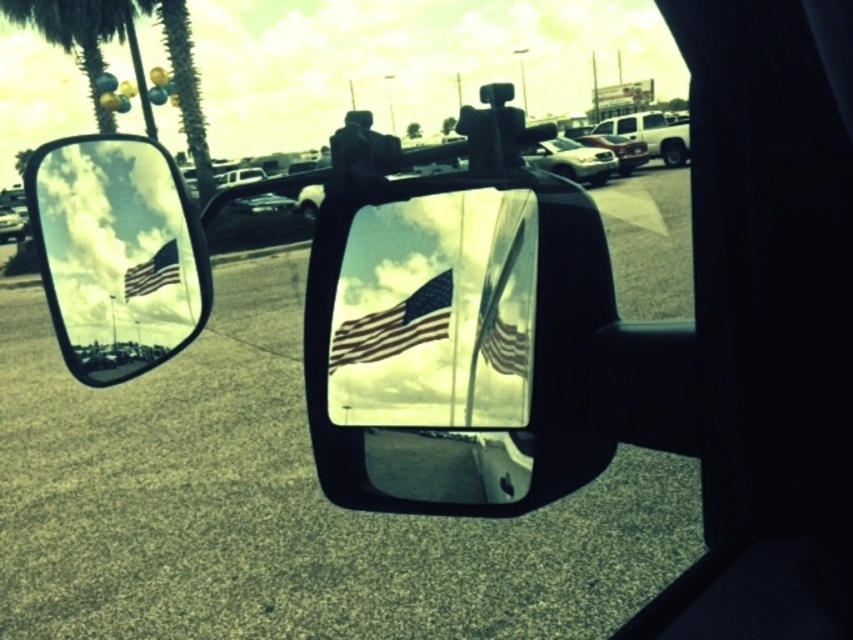
You are a driver checking your side mirrors. You notice a point at coordinates (115, 253). What object is located at that point?

The point at coordinates (115, 253) is where the reflective glass mirror at left is located.

From the picture: You are a driver checking your side mirrors before exiting the car. The reflective glass mirror at left is positioned such that you can see the palm trees outside. If you need to adjust the mirror to better see the palm trees, should you move it closer to or farther away from you?

The reflective glass mirror at left is 3.98 feet away from the viewer. To better see the palm trees, you should move the mirror closer to you. Moving it closer would widen the field of view, allowing more of the palm trees to be visible in the reflection.

You are driving a car and notice the reflective glass mirror at left and the white matte truck at upper right in your side mirrors. Which object is closer to you, the driver?

The reflective glass mirror at left is closer to you because it is positioned in front of the white matte truck at upper right, meaning the truck is further away.